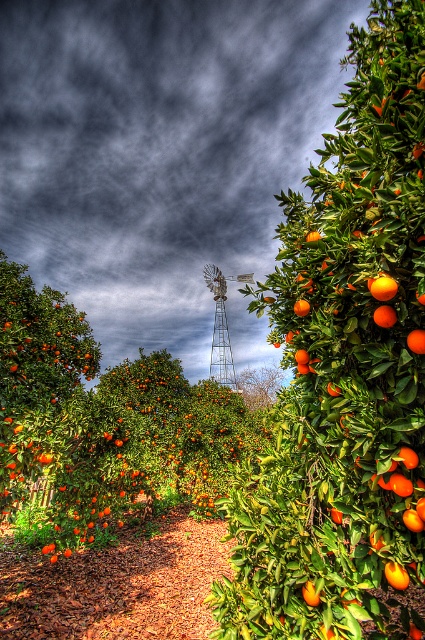
Does shiny orange fruit at right have a greater height compared to brown mulch path at center?

Correct, shiny orange fruit at right is much taller as brown mulch path at center.

Which is in front, point (380, 138) or point (130, 614)?

Point (380, 138)

You are a GUI agent. You are given a task and a screenshot of the screen. Output one action in this format:
    pyautogui.click(x=<x>, y=<y>)
    Task: Click on the shiny orange fruit at right
    The width and height of the screenshot is (425, 640).
    Given the screenshot: What is the action you would take?
    pyautogui.click(x=343, y=371)

Can you confirm if brown mulch path at center is wider than glossy orange at right?

Yes.

Is point (71, 611) positioned after point (396, 564)?

Yes, it is.

Find the location of a particular element. This screenshot has width=425, height=640. brown mulch path at center is located at coordinates (116, 584).

Who is more forward, (373, 634) or (419, 346)?

Positioned in front is point (419, 346).

Where is `shiny orange fruit at right`? This screenshot has height=640, width=425. shiny orange fruit at right is located at coordinates (343, 371).